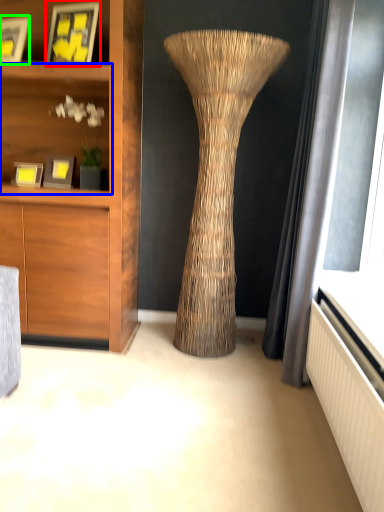
Question: Considering the real-world distances, which object is closest to picture frame (highlighted by a red box)? shelf (highlighted by a blue box) or picture frame (highlighted by a green box).

Choices:
 (A) shelf
 (B) picture frame

Answer: (B)